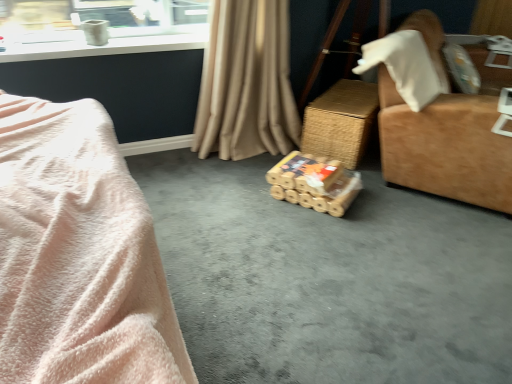
Question: Is suede-like brown armchair at right wider than bamboo-textured toy at center?

Choices:
 (A) yes
 (B) no

Answer: (A)

Question: Can you confirm if suede-like brown armchair at right is bigger than bamboo-textured toy at center?

Choices:
 (A) no
 (B) yes

Answer: (B)

Question: Considering the relative sizes of suede-like brown armchair at right and bamboo-textured toy at center in the image provided, is suede-like brown armchair at right thinner than bamboo-textured toy at center?

Choices:
 (A) no
 (B) yes

Answer: (A)

Question: From the image's perspective, is suede-like brown armchair at right above bamboo-textured toy at center?

Choices:
 (A) no
 (B) yes

Answer: (B)

Question: Is suede-like brown armchair at right at the right side of bamboo-textured toy at center?

Choices:
 (A) yes
 (B) no

Answer: (A)

Question: Is woven brown table at center to the left or to the right of soft pink plush at left in the image?

Choices:
 (A) left
 (B) right

Answer: (B)

Question: In the image, is woven brown table at center positioned in front of or behind soft pink plush at left?

Choices:
 (A) behind
 (B) front

Answer: (A)

Question: From a real-world perspective, is woven brown table at center positioned above or below soft pink plush at left?

Choices:
 (A) above
 (B) below

Answer: (B)

Question: Looking at the image, does woven brown table at center seem bigger or smaller compared to soft pink plush at left?

Choices:
 (A) big
 (B) small

Answer: (A)

Question: Is point (264, 19) closer or farther from the camera than point (288, 372)?

Choices:
 (A) farther
 (B) closer

Answer: (A)

Question: Is beige fabric curtain at center taller or shorter than brown cardboard boxes at center?

Choices:
 (A) tall
 (B) short

Answer: (A)

Question: Choose the correct answer: Is beige fabric curtain at center inside brown cardboard boxes at center or outside it?

Choices:
 (A) outside
 (B) inside

Answer: (A)

Question: Considering the positions of beige fabric curtain at center and brown cardboard boxes at center in the image, is beige fabric curtain at center bigger or smaller than brown cardboard boxes at center?

Choices:
 (A) small
 (B) big

Answer: (B)

Question: In the image, is woven brown table at center positioned in front of or behind beige fabric curtain at center?

Choices:
 (A) front
 (B) behind

Answer: (B)

Question: In terms of width, does woven brown table at center look wider or thinner when compared to beige fabric curtain at center?

Choices:
 (A) thin
 (B) wide

Answer: (B)